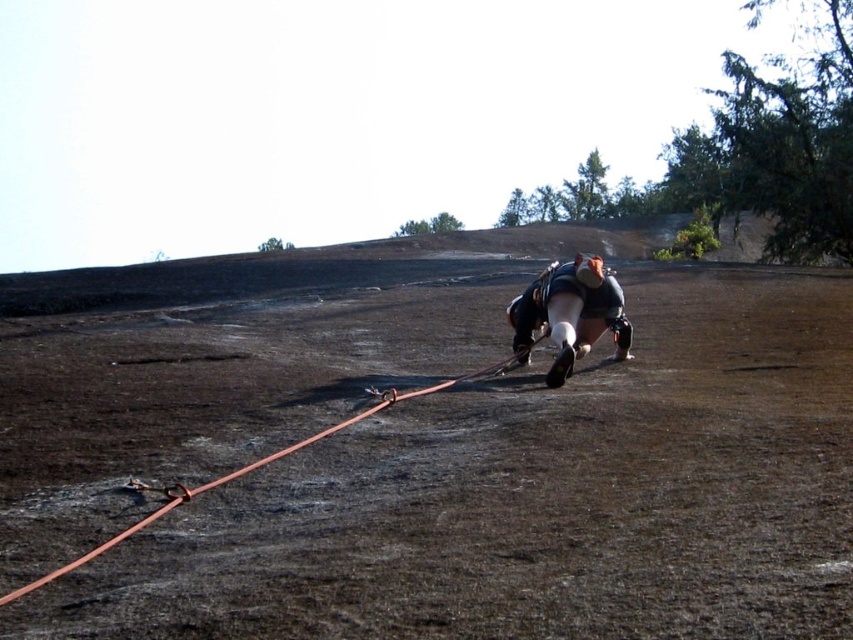
You are a safety inspector assessing the climbing setup. You notice the matte black helmet at center and the orange rubber rope at lower left. Which object is bigger in size?

The matte black helmet at center is larger in size than the orange rubber rope at lower left.

You are a climber trying to navigate between two points on the rock face. The first point is at coordinates point [386,500], and the second point is at coordinates point [599,257]. Which point is closer to you as you face the rock?

Point [386,500] is in front of point [599,257], so it is closer to you as you face the rock.